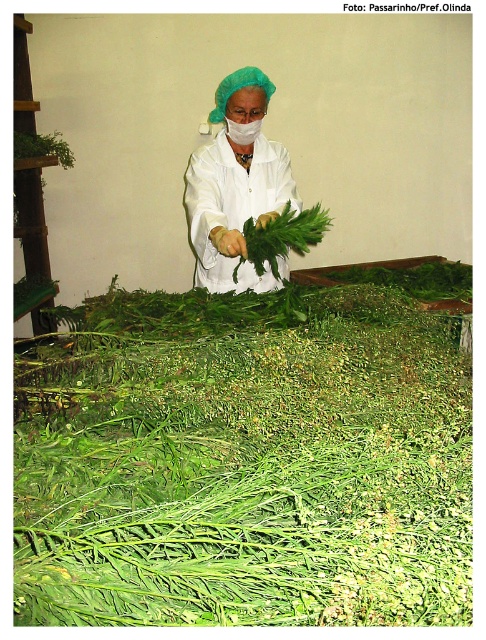
Can you confirm if green leafy grass at center is wider than white matte lab coat at center?

Indeed, green leafy grass at center has a greater width compared to white matte lab coat at center.

Between green leafy grass at center and white matte lab coat at center, which one is positioned higher?

white matte lab coat at center is above.

Measure the distance between point (302, 312) and camera.

Point (302, 312) and camera are 2.15 meters apart from each other.

Find the location of a particular element. Image resolution: width=486 pixels, height=640 pixels. green leafy grass at center is located at coordinates (245, 465).